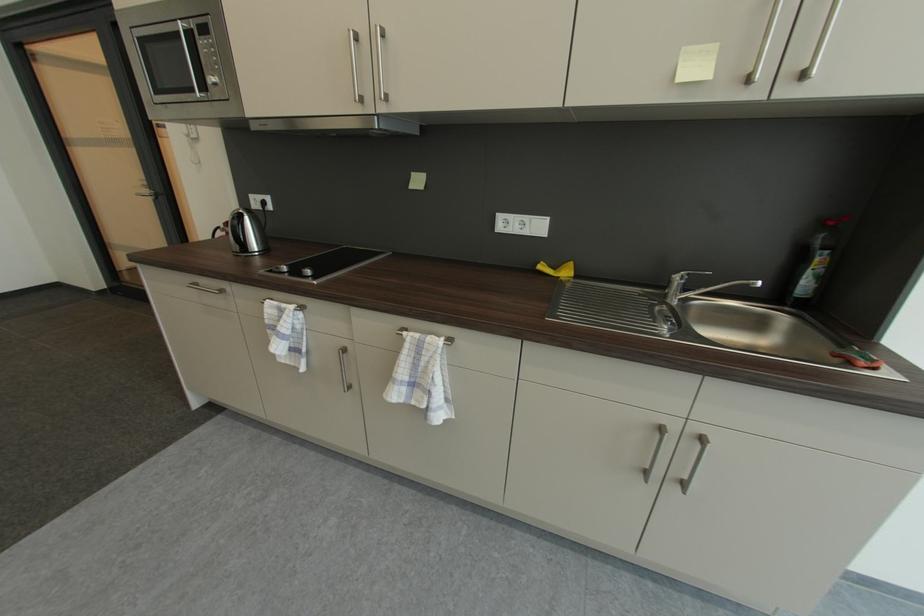
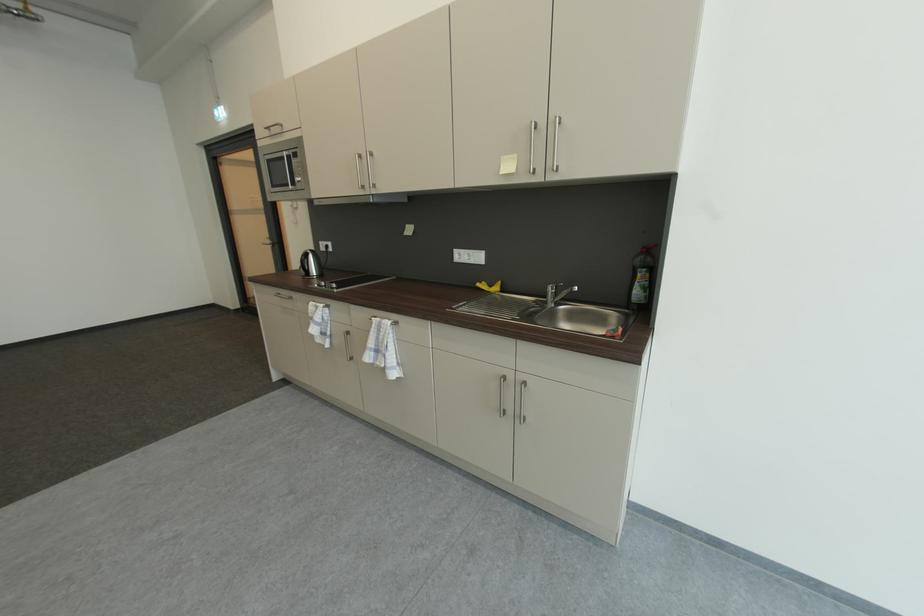
Question: How did the camera likely rotate?

Choices:
 (A) Left
 (B) Right
 (C) Up
 (D) Down

Answer: (A)